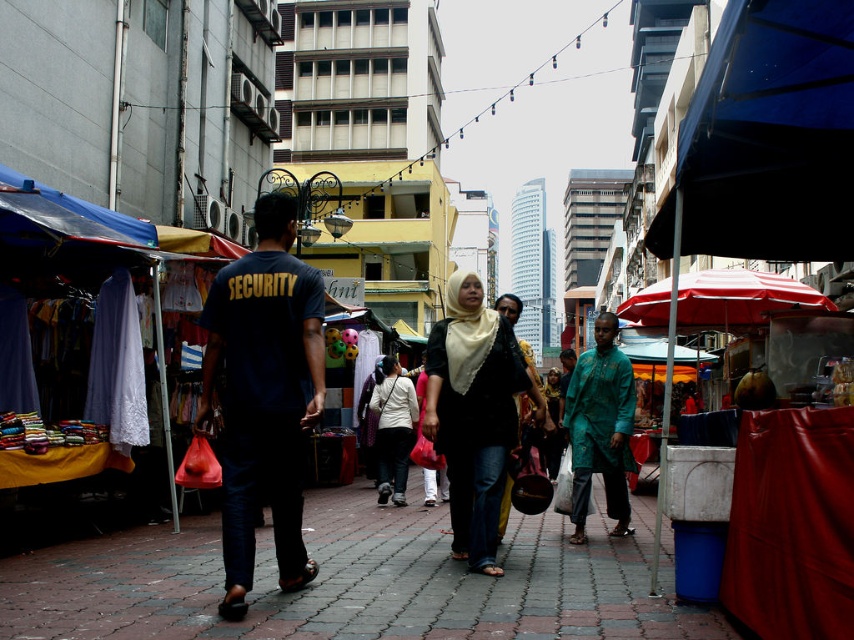
Question: Which of these objects is positioned farthest from the white matte shirt at center?

Choices:
 (A) dark blue cotton security shirt at center
 (B) green textured kurta at center

Answer: (A)

Question: Does green textured kurta at center appear on the right side of white matte shirt at center?

Choices:
 (A) no
 (B) yes

Answer: (B)

Question: Which of the following is the closest to the observer?

Choices:
 (A) dark blue cotton security shirt at center
 (B) brick pavement at center
 (C) matte black hijab at center
 (D) white matte shirt at center

Answer: (B)

Question: Which of these objects is positioned farthest from the white matte shirt at center?

Choices:
 (A) dark blue cotton security shirt at center
 (B) matte black hijab at center
 (C) green textured kurta at center
 (D) brick pavement at center

Answer: (A)

Question: Does green textured kurta at center appear on the right side of white matte shirt at center?

Choices:
 (A) no
 (B) yes

Answer: (B)

Question: Does dark blue cotton security shirt at center have a smaller size compared to matte black hijab at center?

Choices:
 (A) yes
 (B) no

Answer: (A)